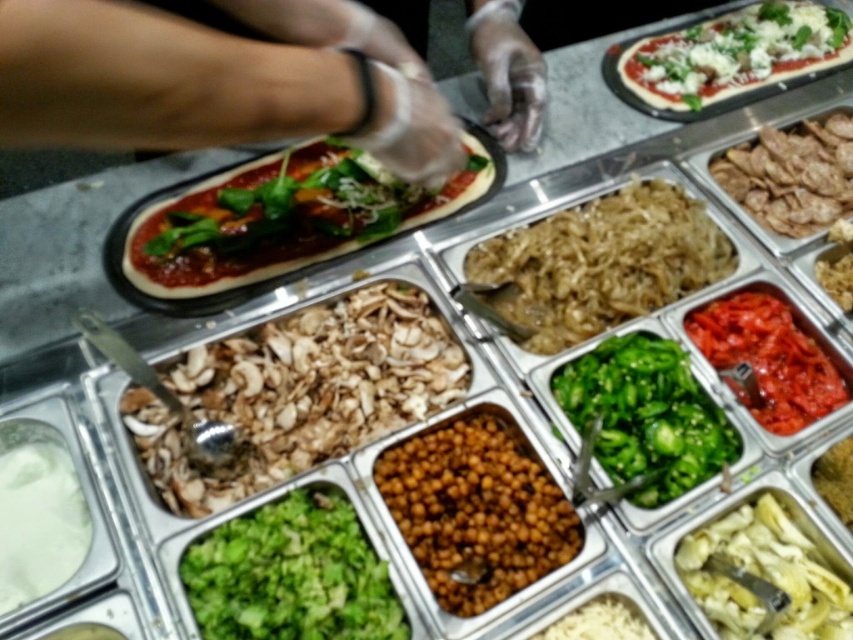
You are a food inspector checking the pizza toppings. The pizza has a matte green leafy vegetable at center and white rice at center. Which topping takes up more space on the pizza?

The matte green leafy vegetable at center is larger in size than the white rice at center, so it takes up more space on the pizza.

You are a food inspector checking the pizza station. You need to place a white glossy artichoke at lower right into a compartment on the metal tray. The compartment is currently occupied by clear plastic gloves at center. Can the artichoke fit into the compartment if you remove the gloves?

The clear plastic gloves at center might be wider than white glossy artichoke at lower right, so there is a possibility that the compartment could accommodate the artichoke after removing the gloves, but the exact fit depends on the artichoke size relative to the gloves.

What is located at the coordinates point (791,173)?

The point (791,173) is on brown crispy meat at center right.